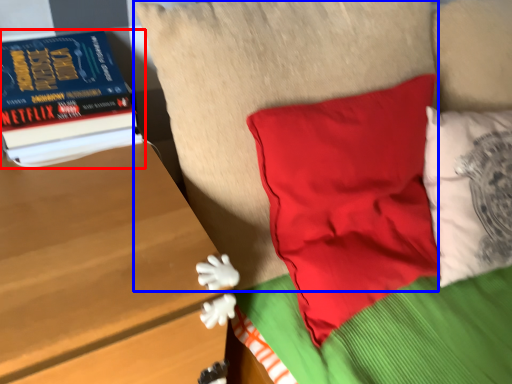
Question: Which object is further to the camera taking this photo, book (highlighted by a red box) or pillow (highlighted by a blue box)?

Choices:
 (A) book
 (B) pillow

Answer: (A)